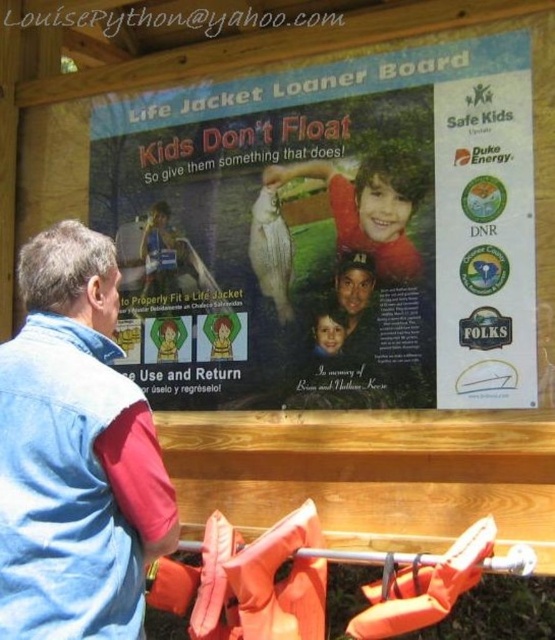
Question: Among these points, which one is farthest from the camera?

Choices:
 (A) (9, 365)
 (B) (428, 212)

Answer: (B)

Question: Which point appears farthest from the camera in this image?

Choices:
 (A) (144, 184)
 (B) (374, 182)
 (C) (31, 476)

Answer: (A)

Question: Does matte paper poster at center appear on the left side of smooth red shirt at center?

Choices:
 (A) yes
 (B) no

Answer: (A)

Question: Observing the image, what is the correct spatial positioning of blue denim jacket at left in reference to smooth red shirt at center?

Choices:
 (A) left
 (B) right

Answer: (A)

Question: Does matte paper poster at center have a greater width compared to smooth red shirt at center?

Choices:
 (A) no
 (B) yes

Answer: (B)

Question: Which object is the farthest from the smooth red shirt at center?

Choices:
 (A) matte paper poster at center
 (B) blue denim jacket at left

Answer: (B)